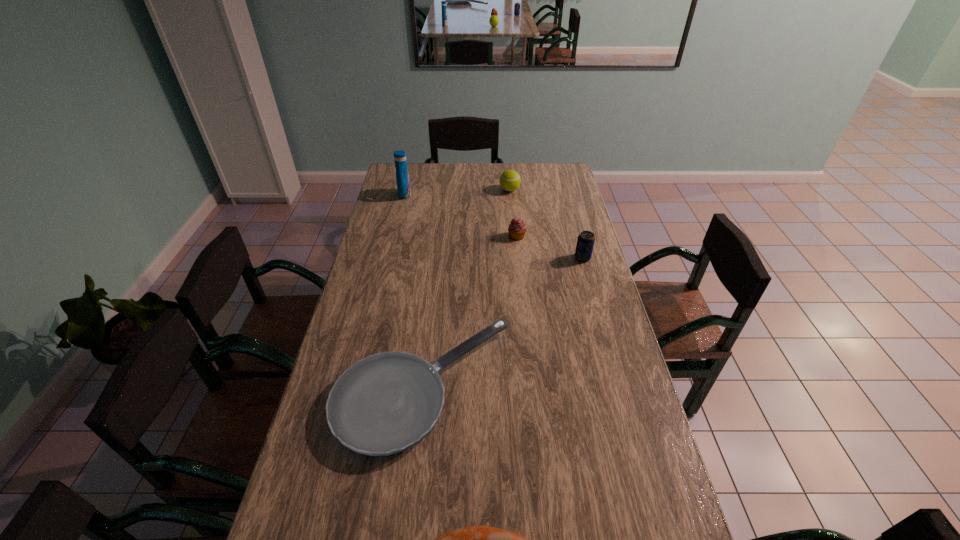
What are the coordinates of `vacant area between the tennis ball and the third nearest object` in the screenshot? It's located at (546, 224).

Where is `vacant space that is in between the cupcake and the tennis ball`? vacant space that is in between the cupcake and the tennis ball is located at coordinates (514, 213).

Locate an element on the screen. The width and height of the screenshot is (960, 540). unoccupied position between the tennis ball and the detergent is located at coordinates (457, 192).

Find the location of `free space between the rightmost object and the cupcake`. free space between the rightmost object and the cupcake is located at coordinates (550, 247).

This screenshot has width=960, height=540. I want to click on vacant space that's between the tennis ball and the frying pan, so click(467, 288).

Identify the location of empty location between the tennis ball and the tallest object. (457, 192).

You are a GUI agent. You are given a task and a screenshot of the screen. Output one action in this format:
    pyautogui.click(x=<x>, y=<y>)
    Task: Click on the vacant region between the detergent and the frying pan
    
    Given the screenshot: What is the action you would take?
    pyautogui.click(x=415, y=291)

Find the location of a particular element. The height and width of the screenshot is (540, 960). vacant point located between the cupcake and the frying pan is located at coordinates (470, 312).

Where is `object that stands as the second closest to the frying pan`? object that stands as the second closest to the frying pan is located at coordinates (585, 243).

The height and width of the screenshot is (540, 960). Identify the location of object that is the second closest to the detergent. (517, 228).